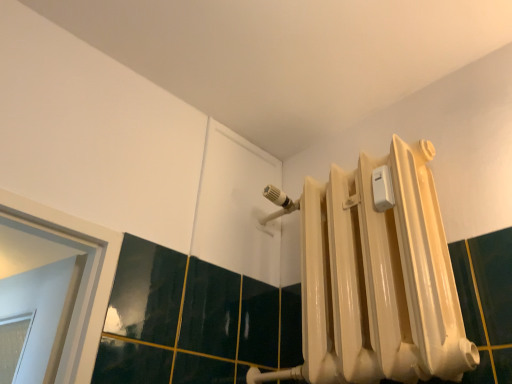
This screenshot has height=384, width=512. Describe the element at coordinates (377, 277) in the screenshot. I see `matte cream radiator at right` at that location.

Where is `matte cream radiator at right`? Image resolution: width=512 pixels, height=384 pixels. matte cream radiator at right is located at coordinates (377, 277).

Measure the distance between matte cream radiator at right and camera.

matte cream radiator at right and camera are 82.99 centimeters apart.

Where is `matte cream radiator at right`? matte cream radiator at right is located at coordinates click(377, 277).